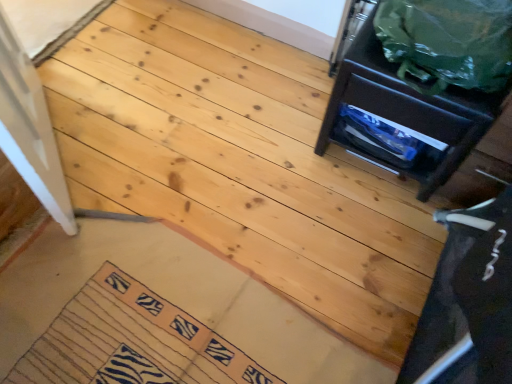
Measure the distance between point (420, 96) and camera.

Point (420, 96) is 1.22 meters from camera.

Locate an element on the screen. The image size is (512, 384). zebra-patterned fabric mat at lower left is located at coordinates (131, 342).

From a real-world perspective, is matte black drawer at upper right beneath green plastic bag at upper right?

Yes.

At what (x,y) coordinates should I click in order to perform the action: click on garbage in front of the matte black drawer at upper right. Please return your answer as a coordinate pair (x, y). Looking at the image, I should click on (448, 42).

Does point (343, 59) lie behind point (443, 54)?

Yes, point (343, 59) is behind point (443, 54).

Can you confirm if matte black drawer at upper right is thinner than green plastic bag at upper right?

No.

Which object is positioned more to the right, zebra-patterned fabric mat at lower left or matte black drawer at upper right?

matte black drawer at upper right.

Which of these two, zebra-patterned fabric mat at lower left or matte black drawer at upper right, stands taller?

matte black drawer at upper right is taller.

From a real-world perspective, is zebra-patterned fabric mat at lower left above or below matte black drawer at upper right?

zebra-patterned fabric mat at lower left is below matte black drawer at upper right.

Is zebra-patterned fabric mat at lower left next to matte black drawer at upper right and touching it?

zebra-patterned fabric mat at lower left is not next to matte black drawer at upper right, and they're not touching.

How many degrees apart are the facing directions of matte black drawer at upper right and zebra-patterned fabric mat at lower left?

The angular difference between matte black drawer at upper right and zebra-patterned fabric mat at lower left is 178 degrees.

From a real-world perspective, is matte black drawer at upper right positioned under zebra-patterned fabric mat at lower left based on gravity?

No.

Considering the points (409, 166) and (170, 383), which point is in front, point (409, 166) or point (170, 383)?

The point (170, 383) is closer.

Considering the relative positions of zebra-patterned fabric mat at lower left and green plastic bag at upper right in the image provided, is zebra-patterned fabric mat at lower left to the left of green plastic bag at upper right from the viewer's perspective?

Indeed, zebra-patterned fabric mat at lower left is positioned on the left side of green plastic bag at upper right.

Is point (97, 371) closer or farther from the camera than point (453, 52)?

Point (97, 371) is farther from the camera than point (453, 52).

Is zebra-patterned fabric mat at lower left inside or outside of green plastic bag at upper right?

zebra-patterned fabric mat at lower left is not inside green plastic bag at upper right, it's outside.

Based on the photo, can you confirm if zebra-patterned fabric mat at lower left is wider than green plastic bag at upper right?

Incorrect, the width of zebra-patterned fabric mat at lower left does not surpass that of green plastic bag at upper right.

Are green plastic bag at upper right and zebra-patterned fabric mat at lower left far apart?

Indeed, green plastic bag at upper right is not near zebra-patterned fabric mat at lower left.

Could you tell me if green plastic bag at upper right is turned towards zebra-patterned fabric mat at lower left?

No, green plastic bag at upper right does not turn towards zebra-patterned fabric mat at lower left.

Who is shorter, green plastic bag at upper right or zebra-patterned fabric mat at lower left?

zebra-patterned fabric mat at lower left.

Identify the location of garbage in front of the matte black drawer at upper right. (448, 42).

Is green plastic bag at upper right in front of or behind matte black drawer at upper right in the image?

In the image, green plastic bag at upper right appears in front of matte black drawer at upper right.

Does green plastic bag at upper right turn towards matte black drawer at upper right?

No, green plastic bag at upper right is not turned towards matte black drawer at upper right.

Considering the relative sizes of green plastic bag at upper right and matte black drawer at upper right in the image provided, is green plastic bag at upper right thinner than matte black drawer at upper right?

Yes.

Locate an element on the screen. furniture behind the green plastic bag at upper right is located at coordinates (408, 112).

At what (x,y) coordinates should I click in order to perform the action: click on doormat below the matte black drawer at upper right (from a real-world perspective). Please return your answer as a coordinate pair (x, y). Image resolution: width=512 pixels, height=384 pixels. Looking at the image, I should click on (131, 342).

From the picture: When comparing their distances from green plastic bag at upper right, does matte black drawer at upper right or zebra-patterned fabric mat at lower left seem further?

Based on the image, zebra-patterned fabric mat at lower left appears to be further to green plastic bag at upper right.

Considering their positions, is green plastic bag at upper right positioned further to matte black drawer at upper right than zebra-patterned fabric mat at lower left?

zebra-patterned fabric mat at lower left lies further to matte black drawer at upper right than the other object.

Estimate the real-world distances between objects in this image. Which object is further from green plastic bag at upper right, zebra-patterned fabric mat at lower left or matte black drawer at upper right?

Based on the image, zebra-patterned fabric mat at lower left appears to be further to green plastic bag at upper right.

Considering their positions, is green plastic bag at upper right positioned closer to zebra-patterned fabric mat at lower left than matte black drawer at upper right?

matte black drawer at upper right is positioned closer to the anchor zebra-patterned fabric mat at lower left.

Based on their spatial positions, is zebra-patterned fabric mat at lower left or green plastic bag at upper right further from matte black drawer at upper right?

zebra-patterned fabric mat at lower left.

From the image, which object appears to be farther from zebra-patterned fabric mat at lower left, matte black drawer at upper right or green plastic bag at upper right?

green plastic bag at upper right.

Identify the location of furniture between green plastic bag at upper right and zebra-patterned fabric mat at lower left in the up-down direction. Image resolution: width=512 pixels, height=384 pixels. (408, 112).